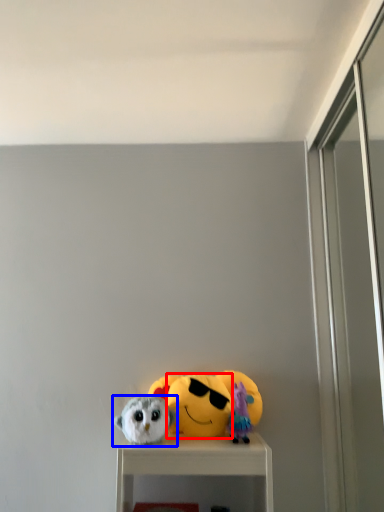
Question: Which point is further to the camera, face (highlighted by a red box) or toy (highlighted by a blue box)?

Choices:
 (A) face
 (B) toy

Answer: (A)